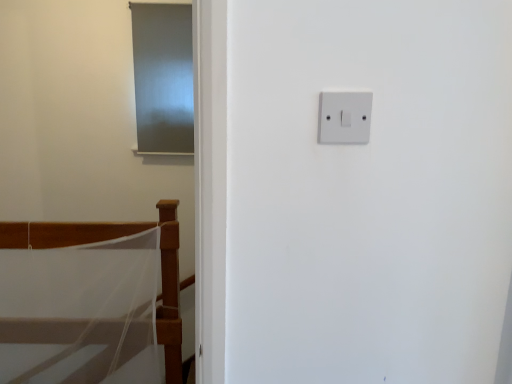
Question: From a real-world perspective, is matte gray screen door at upper left located beneath white mesh bed at lower left?

Choices:
 (A) yes
 (B) no

Answer: (B)

Question: Are matte gray screen door at upper left and white mesh bed at lower left far apart?

Choices:
 (A) yes
 (B) no

Answer: (B)

Question: Does matte gray screen door at upper left have a lesser height compared to white mesh bed at lower left?

Choices:
 (A) no
 (B) yes

Answer: (B)

Question: Is matte gray screen door at upper left positioned beyond the bounds of white mesh bed at lower left?

Choices:
 (A) no
 (B) yes

Answer: (B)

Question: Does matte gray screen door at upper left have a greater height compared to white mesh bed at lower left?

Choices:
 (A) yes
 (B) no

Answer: (B)

Question: Can you confirm if matte gray screen door at upper left is positioned to the right of white mesh bed at lower left?

Choices:
 (A) no
 (B) yes

Answer: (B)

Question: Are matte gray screen door at upper left and white plastic light switch at upper right located far from each other?

Choices:
 (A) no
 (B) yes

Answer: (B)

Question: Is matte gray screen door at upper left shorter than white plastic light switch at upper right?

Choices:
 (A) no
 (B) yes

Answer: (A)

Question: Is matte gray screen door at upper left taller than white plastic light switch at upper right?

Choices:
 (A) yes
 (B) no

Answer: (A)

Question: Does matte gray screen door at upper left appear on the right side of white plastic light switch at upper right?

Choices:
 (A) no
 (B) yes

Answer: (A)

Question: Is matte gray screen door at upper left positioned in front of white plastic light switch at upper right?

Choices:
 (A) yes
 (B) no

Answer: (B)

Question: Would you say matte gray screen door at upper left is outside white plastic light switch at upper right?

Choices:
 (A) no
 (B) yes

Answer: (B)

Question: From a real-world perspective, is white plastic light switch at upper right positioned under white mesh bed at lower left based on gravity?

Choices:
 (A) no
 (B) yes

Answer: (A)